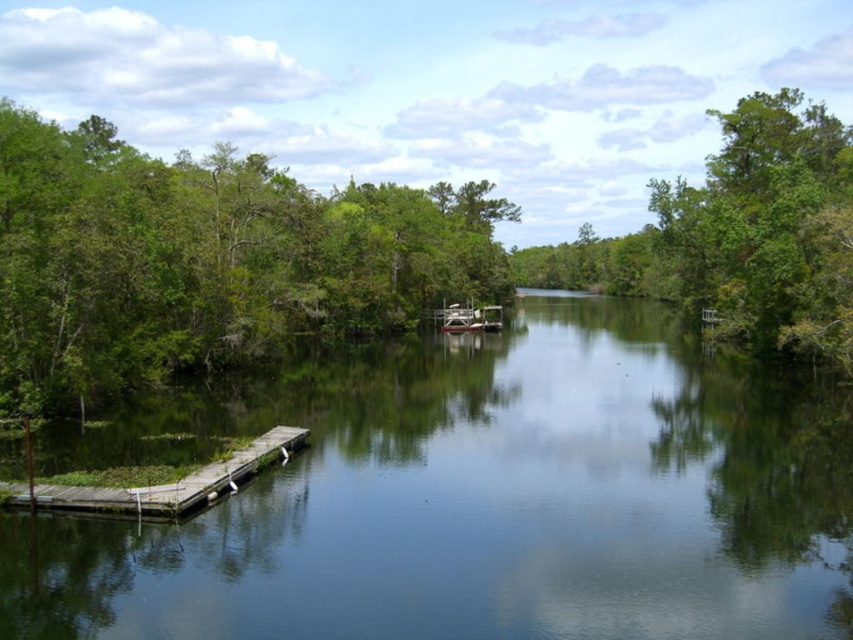
Is point (347, 300) closer to camera compared to point (206, 488)?

No, it is behind (206, 488).

Is green leafy tree at left bigger than wooden dock at left?

Indeed, green leafy tree at left has a larger size compared to wooden dock at left.

Find the location of a particular element. green leafy tree at left is located at coordinates (207, 260).

Is green leafy tree at left wider than green leafy tree at upper right?

Yes, green leafy tree at left is wider than green leafy tree at upper right.

Does green leafy tree at left lie in front of green leafy tree at upper right?

Yes, it is.

This screenshot has width=853, height=640. I want to click on green leafy tree at left, so click(207, 260).

Is point (317, 477) less distant than point (83, 358)?

That is True.

Is green smooth water at center thinner than green leafy tree at left?

Yes.

What are the coordinates of `green smooth water at center` in the screenshot? It's located at (479, 499).

The image size is (853, 640). I want to click on green smooth water at center, so click(x=479, y=499).